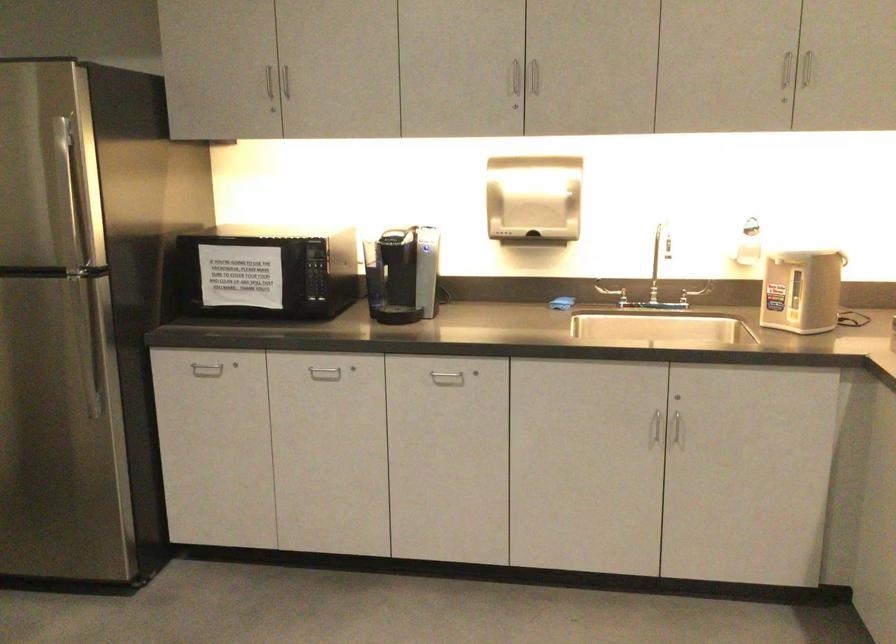
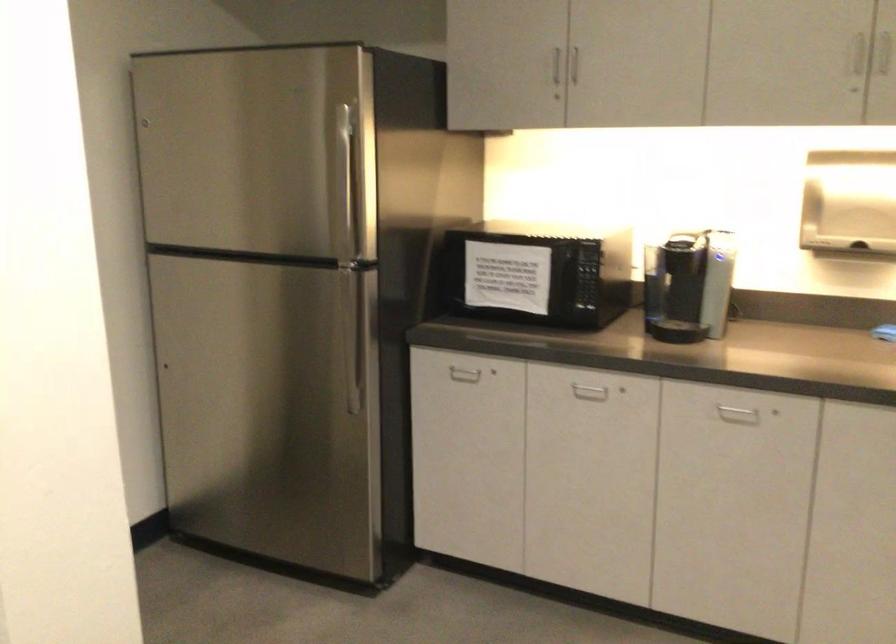
Question: What movement of the cameraman would produce the second image?

Choices:
 (A) Left
 (B) Right
 (C) Forward
 (D) Backward

Answer: (C)